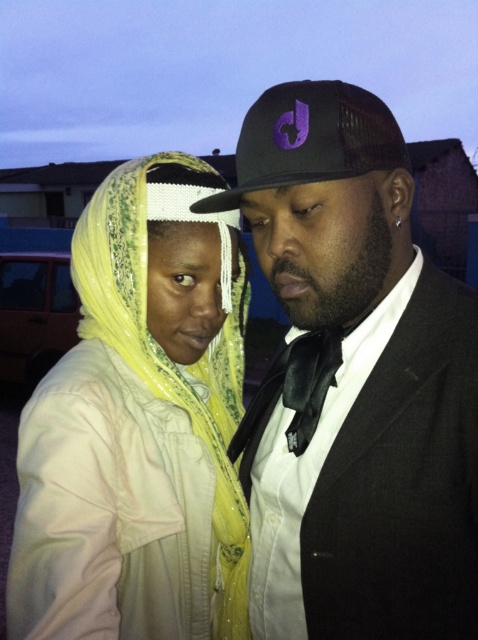
Can you confirm if yellow fabric headscarf at left is taller than black mesh baseball cap at center?

Yes.

Who is more distant from viewer, (x=196, y=220) or (x=313, y=147)?

Point (x=196, y=220)

Describe the element at coordinates (140, 426) in the screenshot. I see `yellow fabric headscarf at left` at that location.

Find the location of `yellow fabric headscarf at left`. yellow fabric headscarf at left is located at coordinates (140, 426).

Between black matte hat at center and black mesh baseball cap at center, which one is positioned higher?

black mesh baseball cap at center is above.

Between point (224, 205) and point (276, 176), which one is positioned behind?

The point (224, 205) is behind.

At what (x,y) coordinates should I click in order to perform the action: click on black matte hat at center. Please return your answer as a coordinate pair (x, y). Looking at the image, I should click on (355, 384).

Which is more to the right, black matte hat at center or yellow fabric headscarf at left?

black matte hat at center

Is black matte hat at center positioned in front of yellow fabric headscarf at left?

No, it is not.

In order to click on black matte hat at center in this screenshot , I will do `click(355, 384)`.